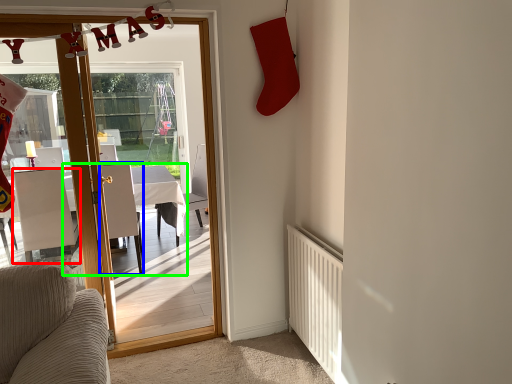
Question: Considering the real-world distances, which object is closest to chair (highlighted by a red box)? chair (highlighted by a blue box) or table (highlighted by a green box).

Choices:
 (A) chair
 (B) table

Answer: (A)